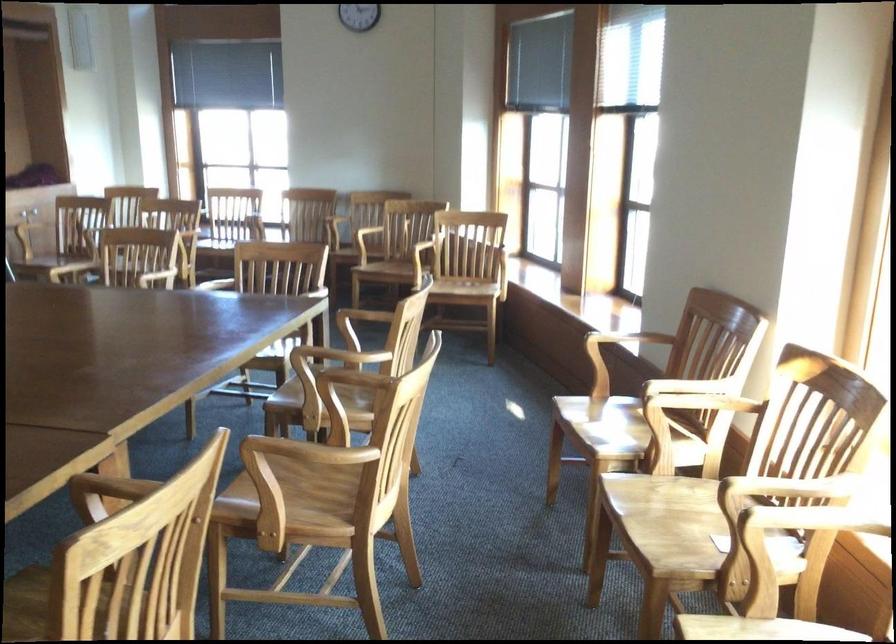
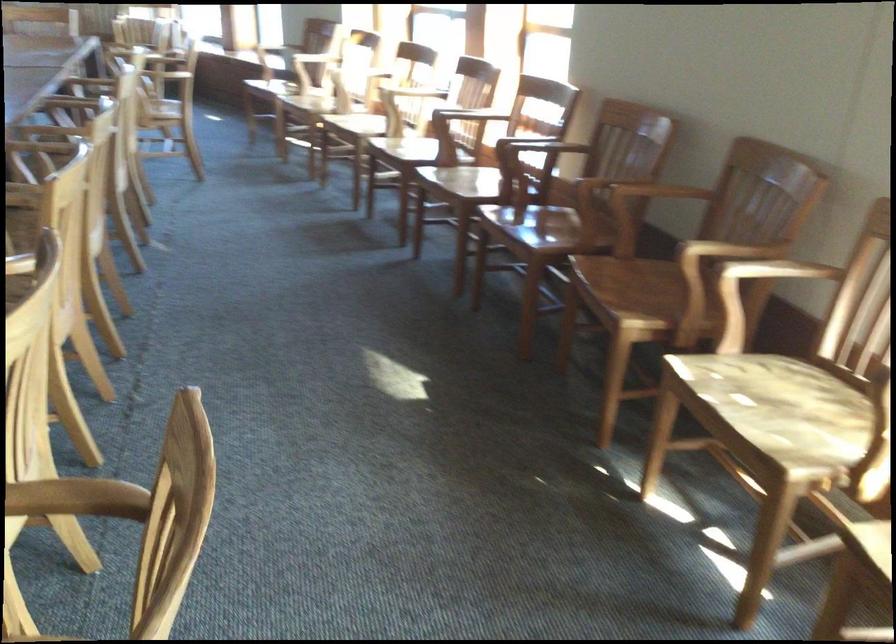
Locate, in the second image, the point that corresponds to (684,352) in the first image.

(312, 58)